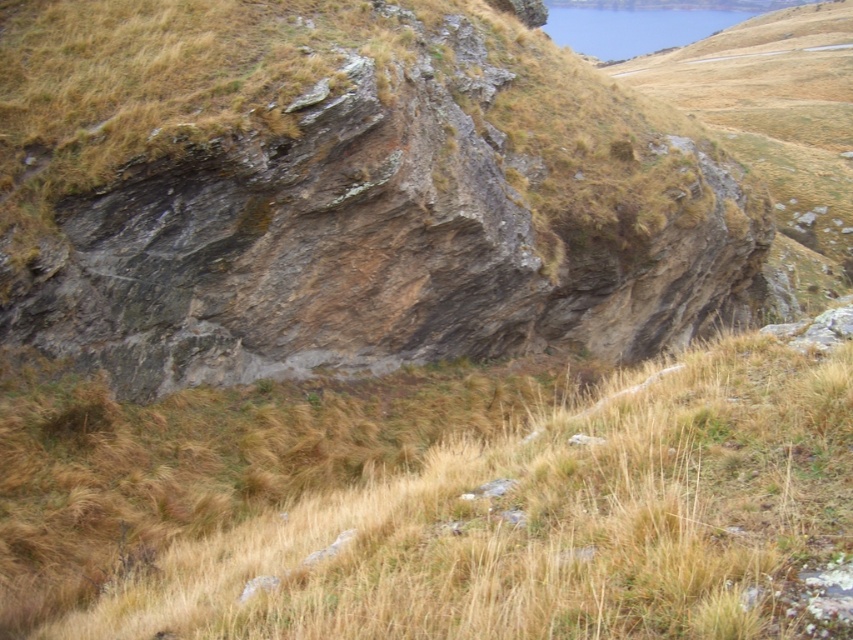
You are standing at the point marked by coordinates [341,193] in the image. Based on the scene description, what object are you most likely standing on?

The point marked by coordinates [341,193] corresponds to the rusty rock formation at center, so you are most likely standing on the rusty rock formation at center.

You are a hiker trying to determine the best path to avoid getting your shoes dirty. The rusty rock formation at center and dry grass at center are both in your path. Which surface would you choose to walk on?

The dry grass at center is less likely to make your shoes dirty compared to the rusty rock formation at center, which has a rough, weathered surface that might have loose particles or dirt. However, the question mentions choosing between the two surfaces in the path, but the Objects Description states that the rusty rock formation at center might be wider than dry grass at center. This implies that the rock formation could cover a larger area, so you might have to walk on it if the dry grass area is smaller